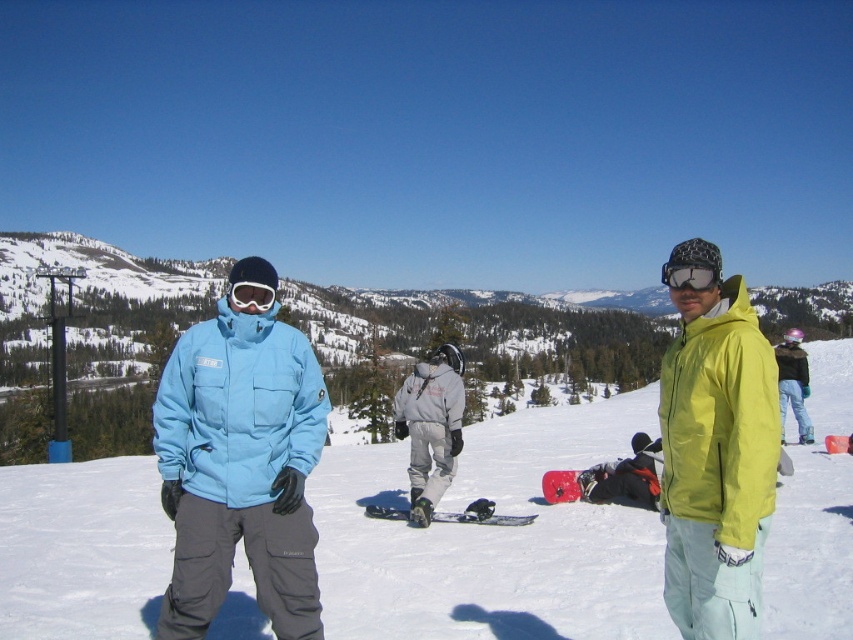
You are a photographer trying to capture a closeup of the matte black goggles at right. Based on the scene description, where should you focus your camera to ensure the goggles are in the frame?

The matte black goggles at right are located at point (691, 273), so you should focus your camera at those coordinates to capture them in the frame.